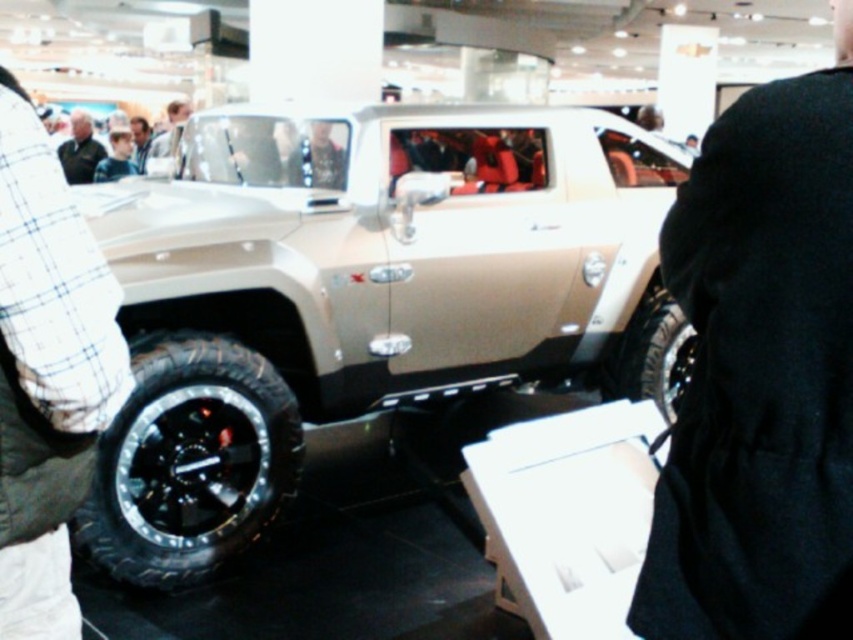
Question: Is satin beige vehicle at center thinner than black rubber tire at lower left?

Choices:
 (A) yes
 (B) no

Answer: (B)

Question: Which object is the closest to the black rubber tire at lower right?

Choices:
 (A) black fabric jacket at center
 (B) plaid fabric shirt at left
 (C) light brown leather jacket at upper center

Answer: (A)

Question: Which object is farther from the camera taking this photo?

Choices:
 (A) satin beige vehicle at center
 (B) black fabric jacket at center
 (C) dark gray jacket at upper left

Answer: (A)

Question: Which of the following is the farthest from the observer?

Choices:
 (A) (154, 173)
 (B) (834, 557)

Answer: (A)

Question: Is satin beige vehicle at center above black rubber tire at lower right?

Choices:
 (A) no
 (B) yes

Answer: (B)

Question: Does black fabric jacket at center have a smaller size compared to light brown leather jacket at upper center?

Choices:
 (A) no
 (B) yes

Answer: (B)